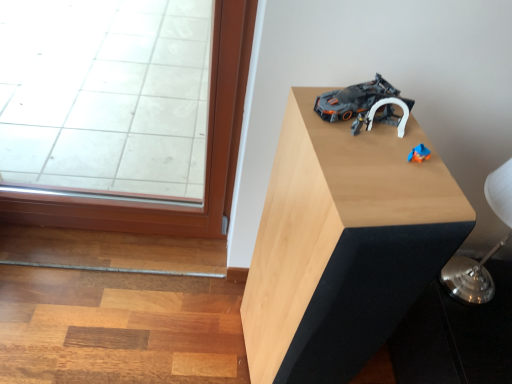
Find the location of a particular element. The image size is (512, 384). free space above light wood table at upper right (from a real-world perspective) is located at coordinates 384,154.